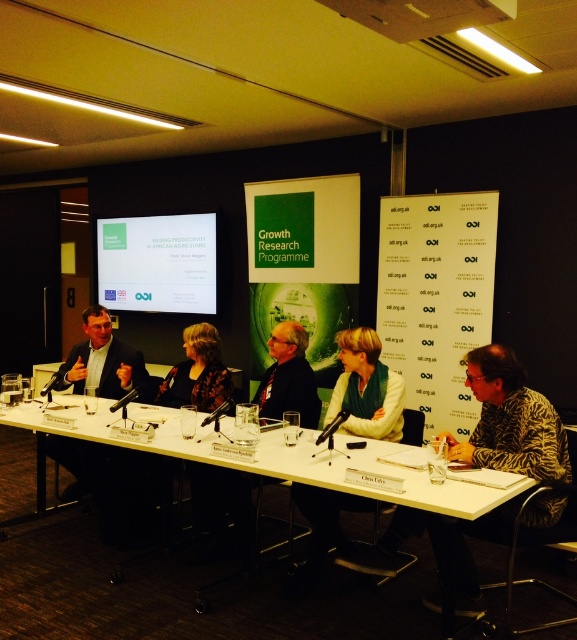
Question: Based on their relative distances, which object is farther from the white glossy projector screen at upper left?

Choices:
 (A) white paper at center
 (B) floral-patterned blouse at center

Answer: (A)

Question: Can you confirm if patterned fabric shirt at right is positioned below floral-patterned blouse at center?

Choices:
 (A) yes
 (B) no

Answer: (A)

Question: Can you confirm if white paper at center is bigger than patterned fabric shirt at right?

Choices:
 (A) no
 (B) yes

Answer: (B)

Question: Which point is farther to the camera?

Choices:
 (A) (125, 442)
 (B) (148, 240)

Answer: (B)

Question: Which point appears farthest from the camera in this image?

Choices:
 (A) (81, 436)
 (B) (440, 360)
 (C) (500, 465)
 (D) (212, 364)

Answer: (B)

Question: Does white paper at center have a smaller size compared to dark suit at left?

Choices:
 (A) yes
 (B) no

Answer: (B)